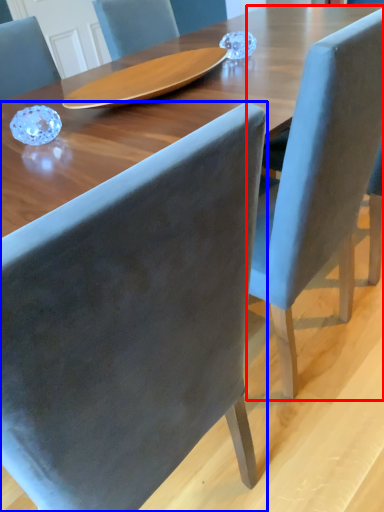
Question: Which point is closer to the camera, chair (highlighted by a red box) or chair (highlighted by a blue box)?

Choices:
 (A) chair
 (B) chair

Answer: (B)